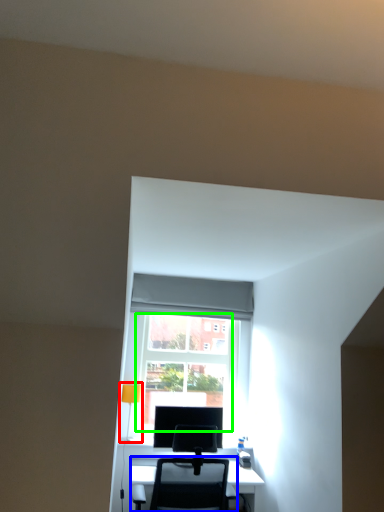
Question: Based on their relative distances, which object is nearer to table lamp (highlighted by a red box)? Choose from chair (highlighted by a blue box) and glass door (highlighted by a green box).

Choices:
 (A) chair
 (B) glass door

Answer: (B)